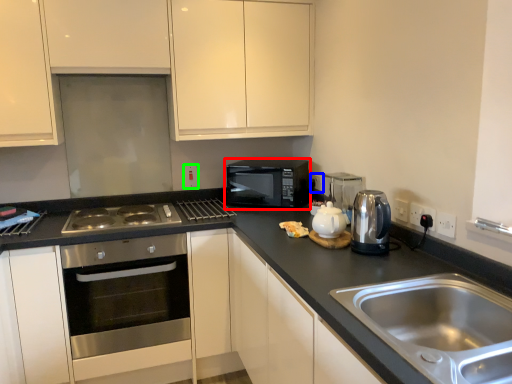
Question: Based on their relative distances, which object is nearer to microwave oven (highlighted by a red box)? Choose from electric outlet (highlighted by a blue box) and electric outlet (highlighted by a green box).

Choices:
 (A) electric outlet
 (B) electric outlet

Answer: (A)